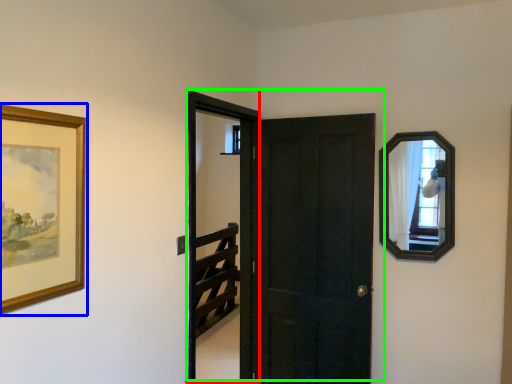
Question: Which is nearer to the screen door (highlighted by a red box)? picture frame (highlighted by a blue box) or door (highlighted by a green box).

Choices:
 (A) picture frame
 (B) door

Answer: (B)